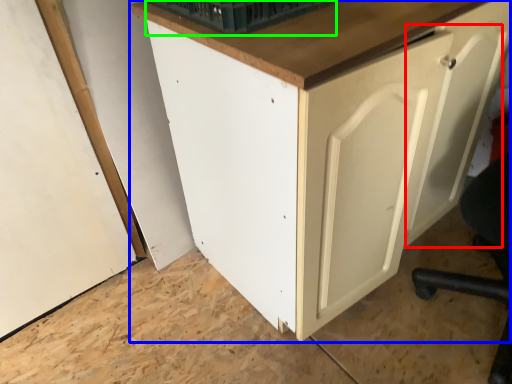
Question: Which object is positioned farthest from door (highlighted by a red box)? Select from cabinetry (highlighted by a blue box) and basket (highlighted by a green box).

Choices:
 (A) cabinetry
 (B) basket

Answer: (B)